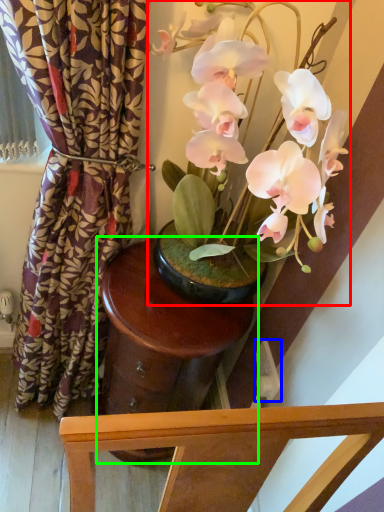
Question: Which is farther away from houseplant (highlighted by a red box)? power outlet (highlighted by a blue box) or round table (highlighted by a green box)?

Choices:
 (A) power outlet
 (B) round table

Answer: (A)